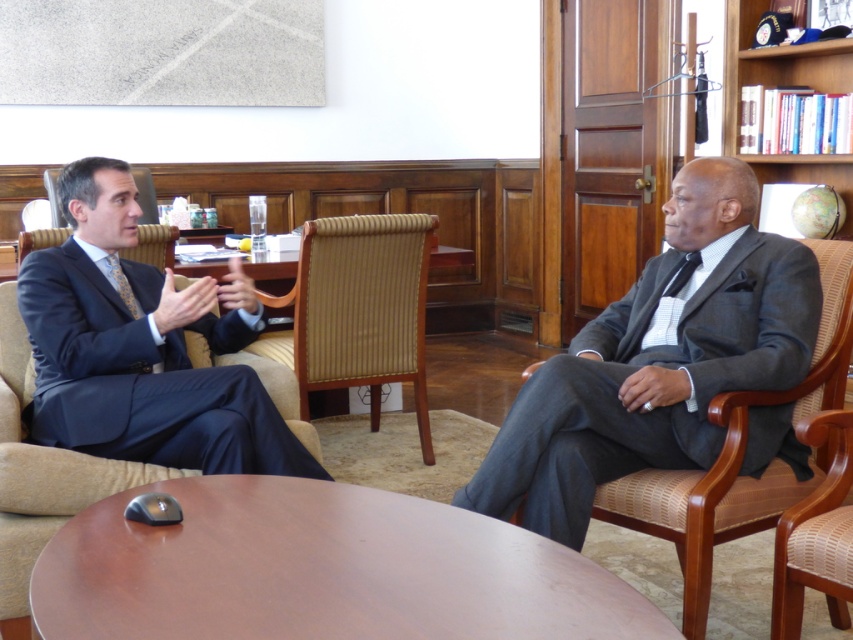
You are a delivery person who needs to place a rectangular box that is 1 meter long on the floor between the brown wood round table at center and the wooden armchair at right. Can the box fit in that space without overlapping either object?

The distance between the brown wood round table at center and the wooden armchair at right is 1.01 meters. Since the box is 1 meter long, it can fit in the space as there is enough room between them.

You are a person who is 1.8 meters tall and standing in front of the brown wood round table at center. Can you comfortably reach the table surface without leaning forward?

The brown wood round table at center is 1.29 meters away from the viewer. Since the average table height for a person of 1.8 meters is typically around 0.76 meters, and assuming standard chair height, the table is likely within comfortable reach. However, the distance from the viewer does not directly indicate height. Further information about the table height is needed to accurately determine reachability.